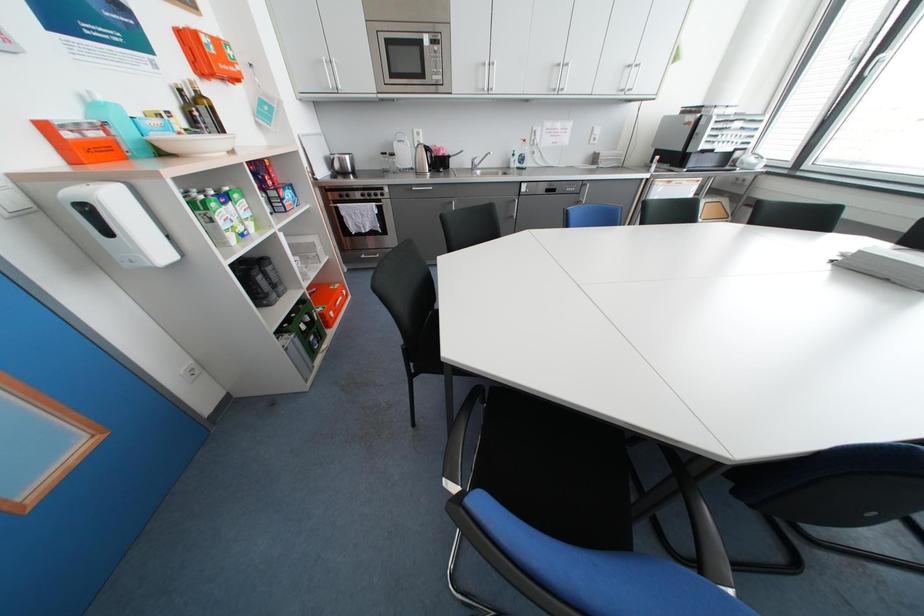
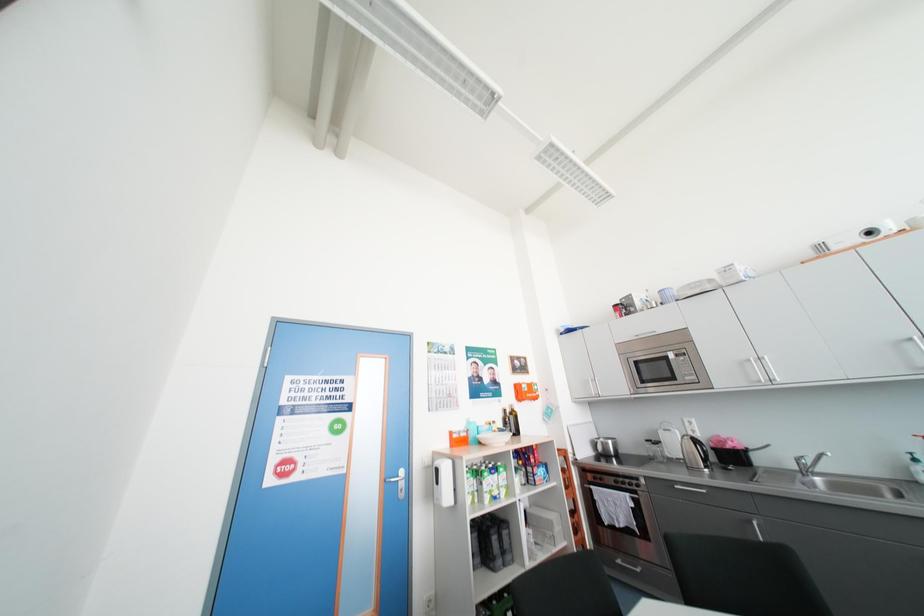
First-person continuous shooting, in which direction is the camera rotating?

The rotation direction of the camera is left-up.